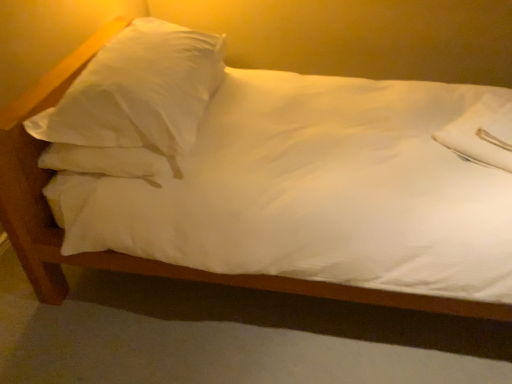
You are a GUI agent. You are given a task and a screenshot of the screen. Output one action in this format:
    pyautogui.click(x=<x>, y=<y>)
    Task: Click on the white satin pillow at upper left, the 2th pillow from the right
    The image size is (512, 384).
    Given the screenshot: What is the action you would take?
    pyautogui.click(x=134, y=103)

Measure the distance between white satin pillow at upper left, the 2th pillow from the right, and camera.

white satin pillow at upper left, the 2th pillow from the right, and camera are 4.21 feet apart.

How much space does white satin pillow at upper left, acting as the first pillow starting from the left, occupy vertically?

white satin pillow at upper left, acting as the first pillow starting from the left, is 18.06 inches tall.

This screenshot has width=512, height=384. What do you see at coordinates (134, 103) in the screenshot?
I see `white satin pillow at upper left, acting as the first pillow starting from the left` at bounding box center [134, 103].

How much space does white satin pillow at upper left, acting as the first pillow starting from the left, occupy horizontally?

The width of white satin pillow at upper left, acting as the first pillow starting from the left, is 23.96 inches.

At what (x,y) coordinates should I click in order to perform the action: click on white soft pillow at upper right, which is the second pillow from left to right. Please return your answer as a coordinate pair (x, y). The height and width of the screenshot is (384, 512). Looking at the image, I should click on (482, 132).

Describe the element at coordinates (482, 132) in the screenshot. Image resolution: width=512 pixels, height=384 pixels. I see `white soft pillow at upper right, which is the second pillow from left to right` at that location.

The image size is (512, 384). What are the coordinates of `white satin pillow at upper left, the 2th pillow from the right` in the screenshot? It's located at (134, 103).

Between white soft pillow at upper right, which is the second pillow from left to right, and white satin pillow at upper left, the 2th pillow from the right, which one appears on the left side from the viewer's perspective?

white satin pillow at upper left, the 2th pillow from the right, is more to the left.

In the image, is white soft pillow at upper right, which is the second pillow from left to right, positioned in front of or behind white satin pillow at upper left, the 2th pillow from the right?

white soft pillow at upper right, which is the second pillow from left to right, is behind white satin pillow at upper left, the 2th pillow from the right.

Considering the points (510, 101) and (108, 165), which point is in front, point (510, 101) or point (108, 165)?

The point (108, 165) is closer to the camera.

From the image's perspective, is white soft pillow at upper right, which is the 1th pillow from right to left, above or below white satin pillow at upper left, acting as the first pillow starting from the left?

Based on their image positions, white soft pillow at upper right, which is the 1th pillow from right to left, is located beneath white satin pillow at upper left, acting as the first pillow starting from the left.

From a real-world perspective, is white soft pillow at upper right, which is the second pillow from left to right, positioned above or below white satin pillow at upper left, the 2th pillow from the right?

In terms of real-world spatial position, white soft pillow at upper right, which is the second pillow from left to right, is below white satin pillow at upper left, the 2th pillow from the right.

Looking at this image, does white soft pillow at upper right, which is the 1th pillow from right to left, have a lesser width compared to white satin pillow at upper left, the 2th pillow from the right?

Yes, white soft pillow at upper right, which is the 1th pillow from right to left, is thinner than white satin pillow at upper left, the 2th pillow from the right.

Which of these two, white soft pillow at upper right, which is the 1th pillow from right to left, or white satin pillow at upper left, the 2th pillow from the right, stands shorter?

With less height is white soft pillow at upper right, which is the 1th pillow from right to left.

Considering the relative sizes of white soft pillow at upper right, which is the 1th pillow from right to left, and white satin pillow at upper left, acting as the first pillow starting from the left, in the image provided, is white soft pillow at upper right, which is the 1th pillow from right to left, bigger than white satin pillow at upper left, acting as the first pillow starting from the left,?

Actually, white soft pillow at upper right, which is the 1th pillow from right to left, might be smaller than white satin pillow at upper left, acting as the first pillow starting from the left.

Looking at this image, do you think white soft pillow at upper right, which is the 1th pillow from right to left, is within white satin pillow at upper left, the 2th pillow from the right, or outside of it?

white soft pillow at upper right, which is the 1th pillow from right to left, is spatially situated outside white satin pillow at upper left, the 2th pillow from the right.

Consider the image. Is white soft pillow at upper right, which is the 1th pillow from right to left, directly adjacent to white satin pillow at upper left, acting as the first pillow starting from the left?

No, white soft pillow at upper right, which is the 1th pillow from right to left, is not making contact with white satin pillow at upper left, acting as the first pillow starting from the left.

Is white soft pillow at upper right, which is the second pillow from left to right, oriented towards white satin pillow at upper left, the 2th pillow from the right?

No, white soft pillow at upper right, which is the second pillow from left to right, does not turn towards white satin pillow at upper left, the 2th pillow from the right.

What's the angular difference between white soft pillow at upper right, which is the second pillow from left to right, and white satin pillow at upper left, acting as the first pillow starting from the left,'s facing directions?

They differ by 148 degrees in their facing directions.

From the picture: Measure the distance between white soft pillow at upper right, which is the 1th pillow from right to left, and white satin pillow at upper left, the 2th pillow from the right.

white soft pillow at upper right, which is the 1th pillow from right to left, and white satin pillow at upper left, the 2th pillow from the right, are 1.03 meters apart from each other.

Locate an element on the screen. This screenshot has width=512, height=384. pillow above the white soft pillow at upper right, which is the second pillow from left to right (from the image's perspective) is located at coordinates (134, 103).

Is white satin pillow at upper left, acting as the first pillow starting from the left, at the right side of white soft pillow at upper right, which is the 1th pillow from right to left?

In fact, white satin pillow at upper left, acting as the first pillow starting from the left, is to the left of white soft pillow at upper right, which is the 1th pillow from right to left.

Which is behind, white satin pillow at upper left, the 2th pillow from the right, or white soft pillow at upper right, which is the 1th pillow from right to left?

white soft pillow at upper right, which is the 1th pillow from right to left, is more distant.

Which is in front, point (136, 125) or point (509, 163)?

The point (136, 125) is closer.

From the image's perspective, is white satin pillow at upper left, acting as the first pillow starting from the left, positioned above or below white soft pillow at upper right, which is the 1th pillow from right to left?

white satin pillow at upper left, acting as the first pillow starting from the left, is situated higher than white soft pillow at upper right, which is the 1th pillow from right to left, in the image.

From a real-world perspective, is white satin pillow at upper left, acting as the first pillow starting from the left, under white soft pillow at upper right, which is the 1th pillow from right to left?

Incorrect, from a real-world perspective, white satin pillow at upper left, acting as the first pillow starting from the left, is higher than white soft pillow at upper right, which is the 1th pillow from right to left.

Does white satin pillow at upper left, acting as the first pillow starting from the left, have a greater width compared to white soft pillow at upper right, which is the second pillow from left to right?

Yes.

Is white satin pillow at upper left, the 2th pillow from the right, taller than white soft pillow at upper right, which is the second pillow from left to right?

Yes, white satin pillow at upper left, the 2th pillow from the right, is taller than white soft pillow at upper right, which is the second pillow from left to right.

Looking at the image, does white satin pillow at upper left, acting as the first pillow starting from the left, seem bigger or smaller compared to white soft pillow at upper right, which is the second pillow from left to right?

Clearly, white satin pillow at upper left, acting as the first pillow starting from the left, is larger in size than white soft pillow at upper right, which is the second pillow from left to right.

Can we say white satin pillow at upper left, the 2th pillow from the right, lies outside white soft pillow at upper right, which is the 1th pillow from right to left?

Indeed, white satin pillow at upper left, the 2th pillow from the right, is completely outside white soft pillow at upper right, which is the 1th pillow from right to left.

Is white satin pillow at upper left, the 2th pillow from the right, touching white soft pillow at upper right, which is the second pillow from left to right?

No, white satin pillow at upper left, the 2th pillow from the right, is not in contact with white soft pillow at upper right, which is the second pillow from left to right.

Does white satin pillow at upper left, acting as the first pillow starting from the left, turn towards white soft pillow at upper right, which is the second pillow from left to right?

No, white satin pillow at upper left, acting as the first pillow starting from the left, is not turned towards white soft pillow at upper right, which is the second pillow from left to right.

How many degrees apart are the facing directions of white satin pillow at upper left, acting as the first pillow starting from the left, and white soft pillow at upper right, which is the second pillow from left to right?

white satin pillow at upper left, acting as the first pillow starting from the left, and white soft pillow at upper right, which is the second pillow from left to right, are facing 148 degrees away from each other.

The image size is (512, 384). Find the location of `pillow that appears above the white soft pillow at upper right, which is the 1th pillow from right to left (from a real-world perspective)`. pillow that appears above the white soft pillow at upper right, which is the 1th pillow from right to left (from a real-world perspective) is located at coordinates (134, 103).

In order to click on pillow on the right side of white satin pillow at upper left, the 2th pillow from the right in this screenshot , I will do `click(482, 132)`.

The width and height of the screenshot is (512, 384). Find the location of `pillow in front of the white soft pillow at upper right, which is the second pillow from left to right`. pillow in front of the white soft pillow at upper right, which is the second pillow from left to right is located at coordinates (134, 103).